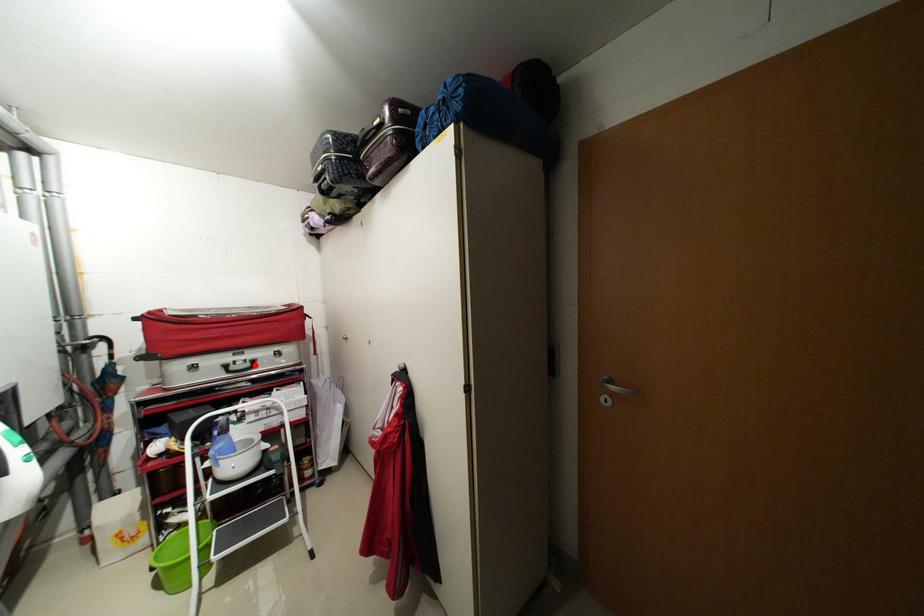
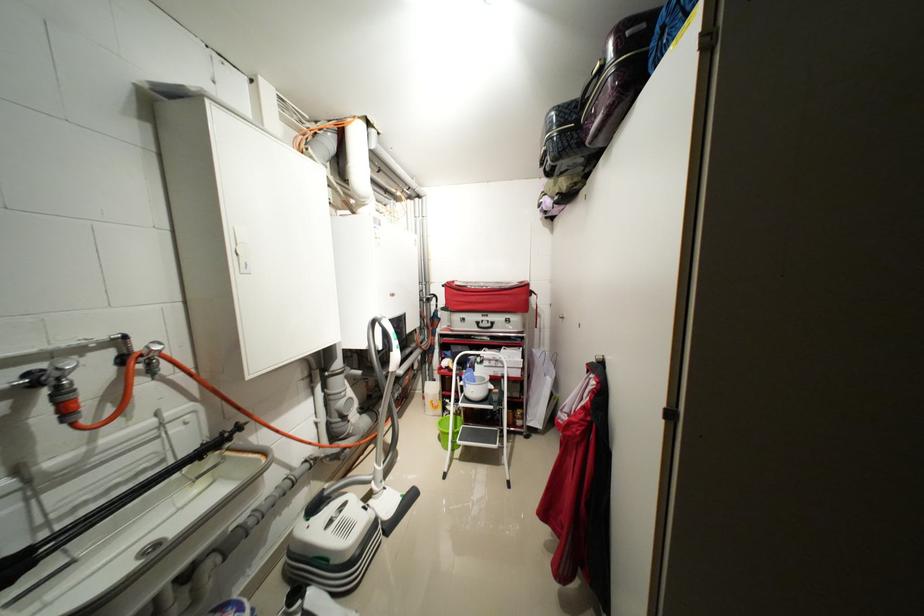
In the second image, find the point that corresponds to the highlighted location in the first image.

(496, 326)